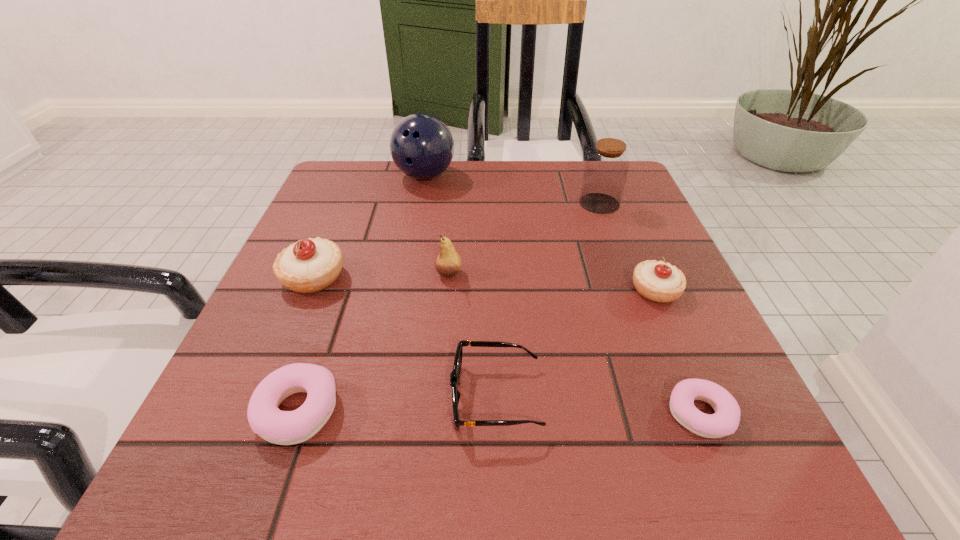
The width and height of the screenshot is (960, 540). Find the location of `free space between the farthest object and the second shortest pastry`. free space between the farthest object and the second shortest pastry is located at coordinates (361, 293).

I want to click on free spot between the sunglasses and the pear, so [472, 335].

Find the location of a particular element. The image size is (960, 540). free space between the second shortest pastry and the sixth shortest object is located at coordinates (373, 342).

You are a GUI agent. You are given a task and a screenshot of the screen. Output one action in this format:
    pyautogui.click(x=<x>, y=<y>)
    Task: Click on the empty location between the third tallest pastry and the blue bowling ball
    
    Given the screenshot: What is the action you would take?
    pyautogui.click(x=361, y=293)

At what (x,y) coordinates should I click in order to perform the action: click on vacant area between the jar and the blue bowling ball. Please return your answer as a coordinate pair (x, y). Looking at the image, I should click on (512, 190).

Select which object is the sixth closest to the jar. Please provide its 2D coordinates. Your answer should be formatted as a tuple, i.e. [(x, y)], where the tuple contains the x and y coordinates of a point satisfying the conditions above.

[(310, 265)]

Identify which object is located as the second nearest to the brown jar. Please provide its 2D coordinates. Your answer should be formatted as a tuple, i.e. [(x, y)], where the tuple contains the x and y coordinates of a point satisfying the conditions above.

[(421, 145)]

In order to click on pastry that is the closest to the brown jar in this screenshot , I will do `click(657, 281)`.

Locate an element on the screen. the fourth closest pastry to the black sunglasses is located at coordinates (310, 265).

The height and width of the screenshot is (540, 960). In order to click on vacant region that satisfies the following two spatial constraints: 1. on the front-facing side of the shortest pastry; 2. on the right side of the black sunglasses in this screenshot , I will do `click(496, 414)`.